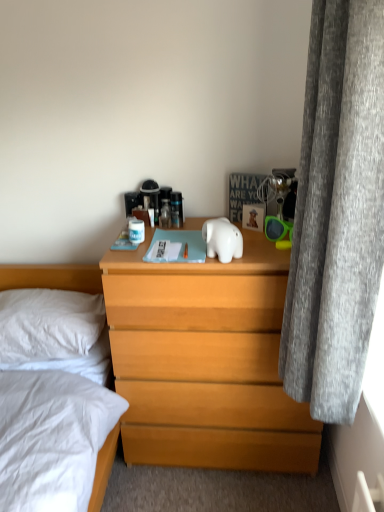
Find the location of a particular element. The height and width of the screenshot is (512, 384). free location above white soft pillow at left (from a real-world perspective) is located at coordinates (44, 306).